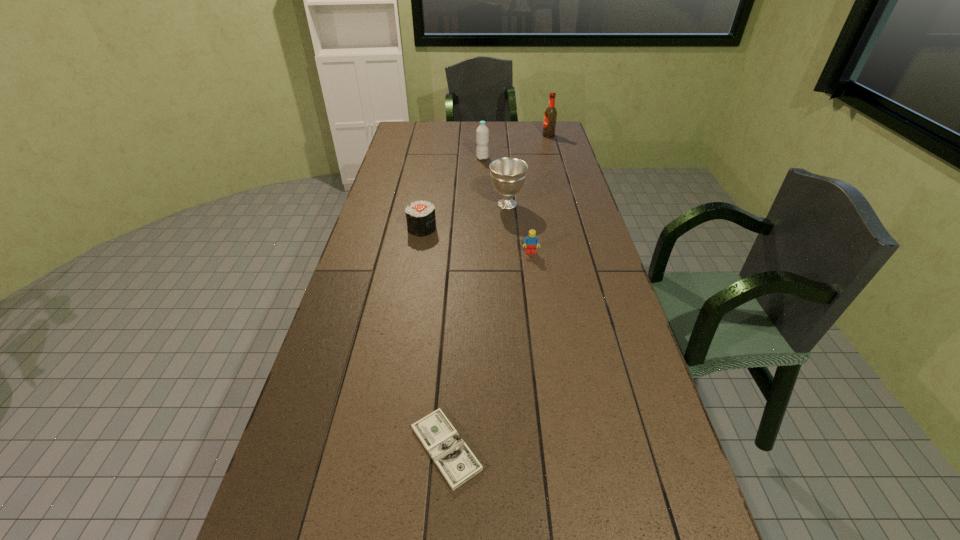
Find the location of a particular element. the farthest object is located at coordinates (550, 115).

Where is `the rightmost object`? the rightmost object is located at coordinates coord(550,115).

You are a GUI agent. You are given a task and a screenshot of the screen. Output one action in this format:
    pyautogui.click(x=<x>, y=<y>)
    Task: Click on the second farthest object
    This screenshot has width=960, height=540.
    Given the screenshot: What is the action you would take?
    pyautogui.click(x=482, y=133)

Locate an element on the screen. chalice is located at coordinates [508, 175].

Locate an element on the screen. This screenshot has height=540, width=960. the fourth farthest object is located at coordinates (421, 220).

What are the coordinates of `sushi` in the screenshot? It's located at (421, 220).

Where is `Lego`? The width and height of the screenshot is (960, 540). Lego is located at coordinates (530, 242).

This screenshot has height=540, width=960. What are the coordinates of `the shortest object` in the screenshot? It's located at (454, 459).

Locate an element on the screen. The width and height of the screenshot is (960, 540). dollar is located at coordinates (454, 459).

Image resolution: width=960 pixels, height=540 pixels. Identify the location of vacant space situated 0.120m on the left of the beer bottle. (518, 136).